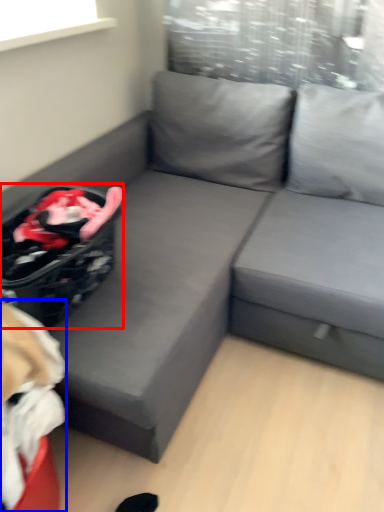
Question: Which object is closer to the camera taking this photo, laundry basket (highlighted by a red box) or bean bag chair (highlighted by a blue box)?

Choices:
 (A) laundry basket
 (B) bean bag chair

Answer: (B)